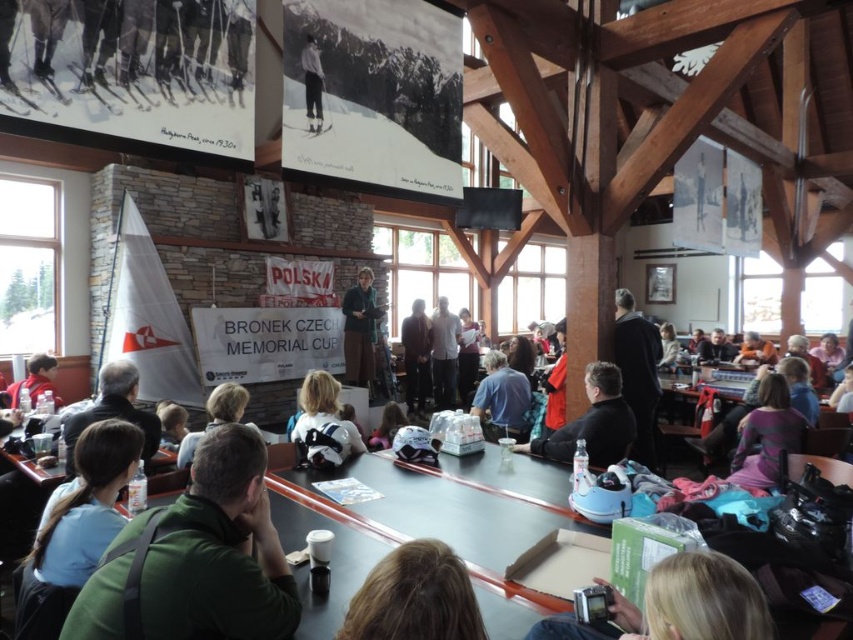
Question: Where is silvery metallic camera at lower center located in relation to blue fabric shirt at center in the image?

Choices:
 (A) left
 (B) right

Answer: (A)

Question: Which of the following is the closest to the observer?

Choices:
 (A) dark green jacket at center
 (B) blue fabric shirt at center
 (C) striped sweater at center

Answer: (C)

Question: Is silvery metallic camera at lower center bigger than dark blue jacket at center?

Choices:
 (A) no
 (B) yes

Answer: (A)

Question: Is blonde hair at lower center positioned at the back of light brown wooden skis at center?

Choices:
 (A) no
 (B) yes

Answer: (A)

Question: Which object is positioned closest to the white shirt at center?

Choices:
 (A) green matte shirt at center
 (B) blonde hair at lower center

Answer: (A)

Question: Considering the real-world distances, which object is closest to the dark green jacket at center?

Choices:
 (A) striped sweater at center
 (B) green matte shirt at center
 (C) matte red jacket at lower left
 (D) silvery metallic camera at lower center

Answer: (B)